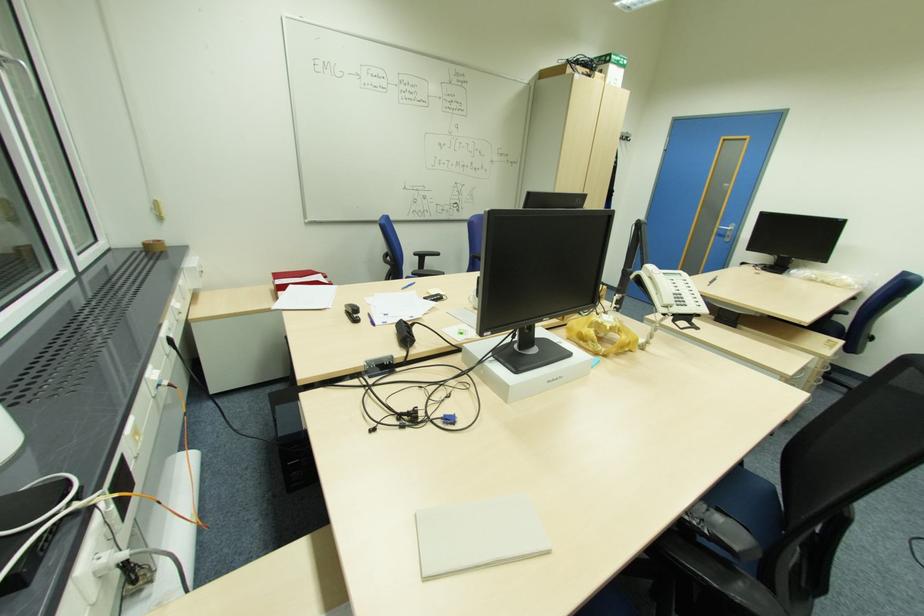
Locate an element on the screen. telephone button is located at coordinates (687, 299).